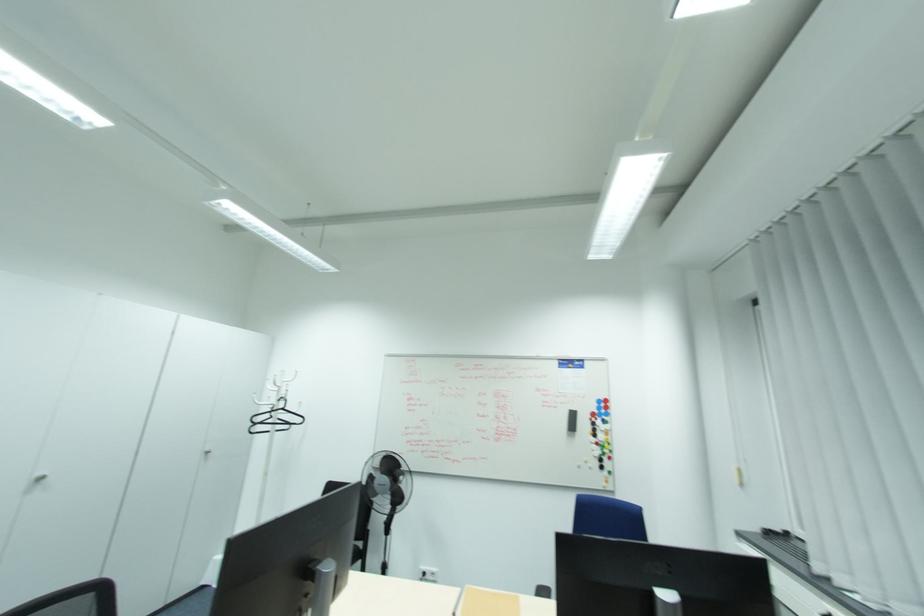
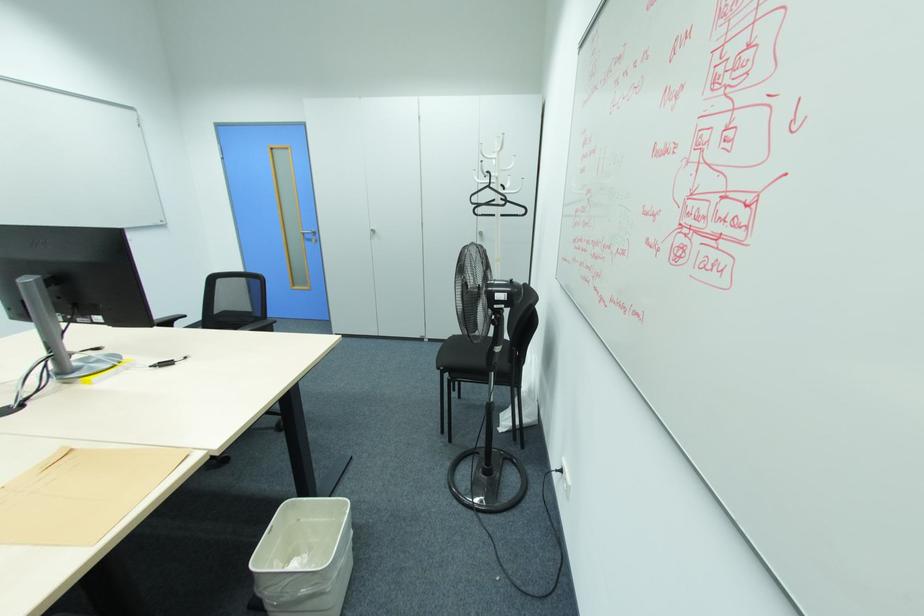
Find the pixel in the second image that matches (284,408) in the first image.

(490, 187)